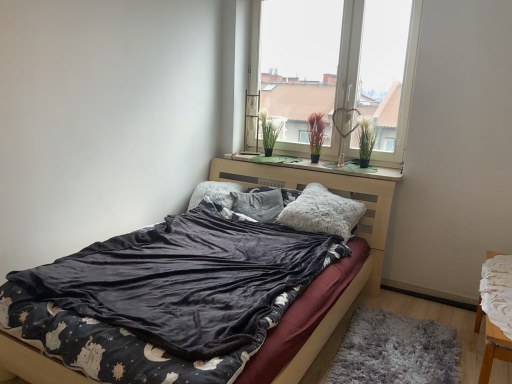
Question: Is green matte plant at upper right, which appears as the 3th plant when viewed from the left, not near fluffy gray pillow at center, the 1th pillow viewed from the right?

Choices:
 (A) no
 (B) yes

Answer: (A)

Question: Does green matte plant at upper right, which appears as the 1th plant when viewed from the right, have a lesser height compared to fluffy gray pillow at center, the 1th pillow viewed from the right?

Choices:
 (A) no
 (B) yes

Answer: (A)

Question: From the image's perspective, does green matte plant at upper right, which appears as the 1th plant when viewed from the right, appear higher than fluffy gray pillow at center, the 1th pillow viewed from the right?

Choices:
 (A) yes
 (B) no

Answer: (A)

Question: Does green matte plant at upper right, which appears as the 3th plant when viewed from the left, have a greater height compared to fluffy gray pillow at center, placed as the third pillow when sorted from left to right?

Choices:
 (A) yes
 (B) no

Answer: (A)

Question: Are green matte plant at upper right, which appears as the 1th plant when viewed from the right, and fluffy gray pillow at center, placed as the third pillow when sorted from left to right, making contact?

Choices:
 (A) yes
 (B) no

Answer: (B)

Question: Does green matte plant at upper right, which appears as the 1th plant when viewed from the right, have a larger size compared to fluffy gray pillow at center, the 1th pillow viewed from the right?

Choices:
 (A) no
 (B) yes

Answer: (A)

Question: From the image's perspective, is gray shaggy rug at lower right above velvet dark gray bed at center?

Choices:
 (A) no
 (B) yes

Answer: (A)

Question: Could you tell me if gray shaggy rug at lower right is facing velvet dark gray bed at center?

Choices:
 (A) no
 (B) yes

Answer: (A)

Question: Considering the relative sizes of gray shaggy rug at lower right and velvet dark gray bed at center in the image provided, is gray shaggy rug at lower right bigger than velvet dark gray bed at center?

Choices:
 (A) no
 (B) yes

Answer: (A)

Question: Is gray shaggy rug at lower right smaller than velvet dark gray bed at center?

Choices:
 (A) no
 (B) yes

Answer: (B)

Question: Considering the relative sizes of gray shaggy rug at lower right and velvet dark gray bed at center in the image provided, is gray shaggy rug at lower right wider than velvet dark gray bed at center?

Choices:
 (A) yes
 (B) no

Answer: (B)

Question: From a real-world perspective, is gray shaggy rug at lower right under velvet dark gray bed at center?

Choices:
 (A) yes
 (B) no

Answer: (A)

Question: Could you tell me if fluffy gray pillow at center, the 2th pillow viewed from the right, is turned towards green felt at center?

Choices:
 (A) yes
 (B) no

Answer: (B)